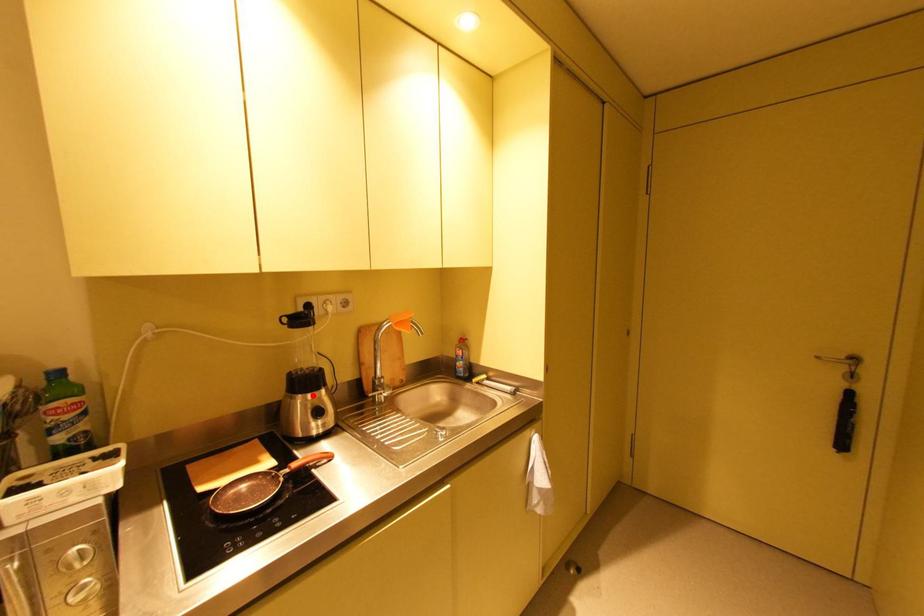
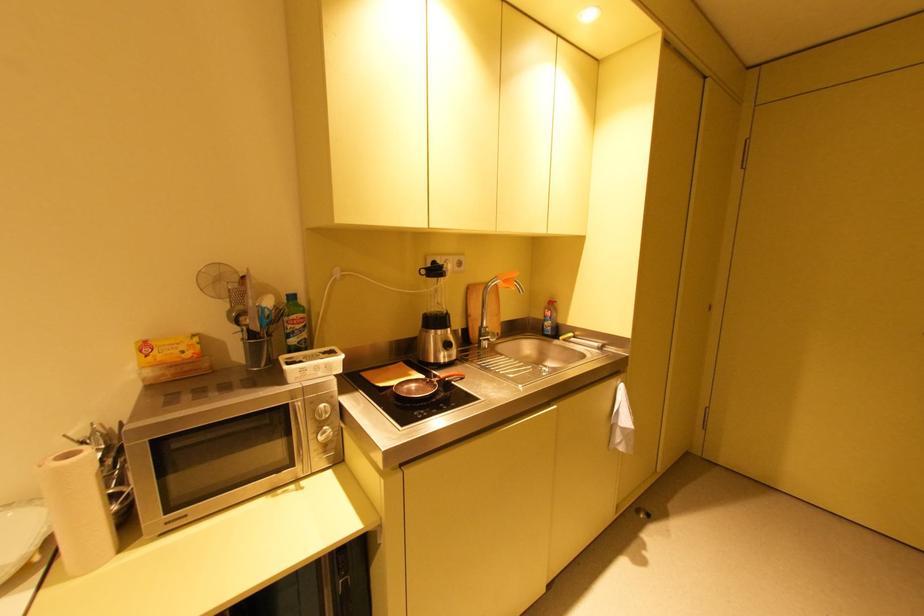
The point at the highlighted location is marked in the first image. Where is the corresponding point in the second image?

(444, 331)